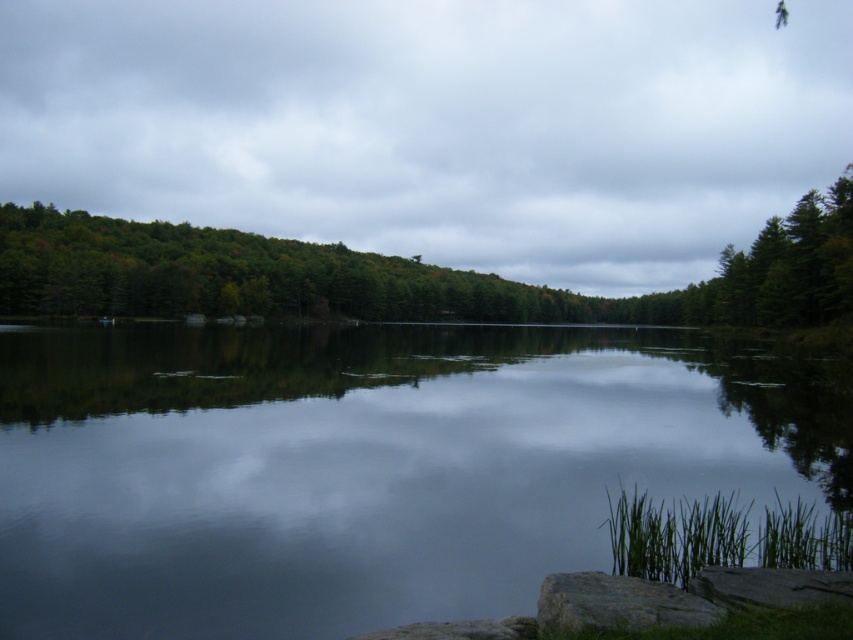
Is transparent water at center above green matte tree at upper center?

Incorrect, transparent water at center is not positioned above green matte tree at upper center.

Who is higher up, transparent water at center or green matte tree at upper center?

green matte tree at upper center

Between point (326, 438) and point (262, 241), which one is positioned behind?

The point (262, 241) is more distant.

At what (x,y) coordinates should I click in order to perform the action: click on transparent water at center. Please return your answer as a coordinate pair (x, y). This screenshot has height=640, width=853. Looking at the image, I should click on (366, 467).